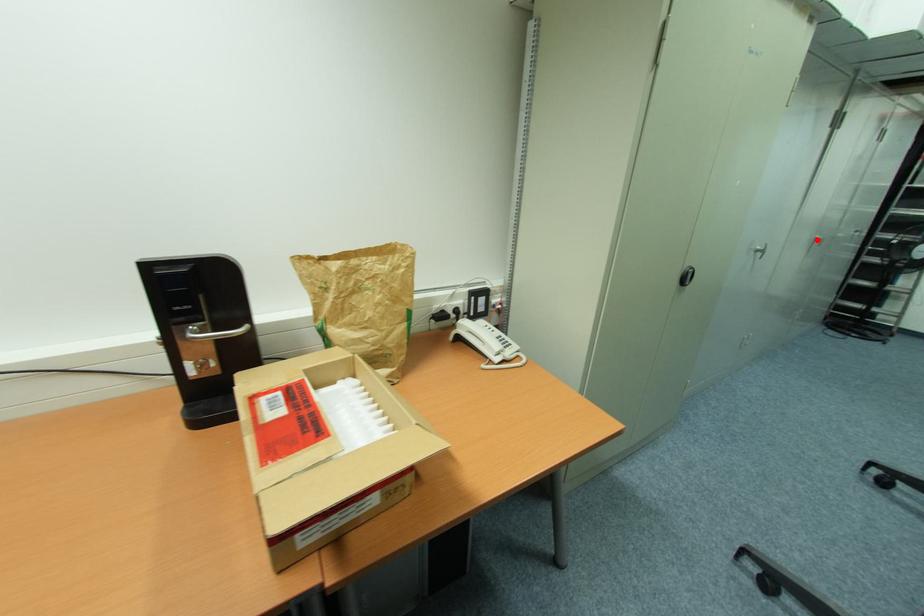
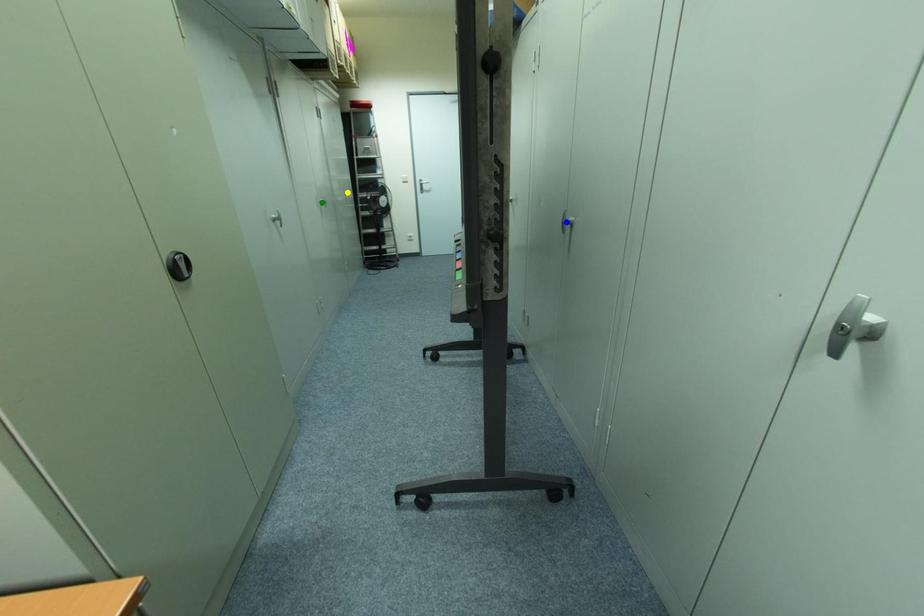
Question: I am providing you with two images of the same scene from different viewpoints. A red point is marked on the first image. You are given multiple points on the second image. Which point in image 2 is actually the same real-world point as the red point in image 1?

Choices:
 (A) green point
 (B) blue point
 (C) yellow point

Answer: (A)